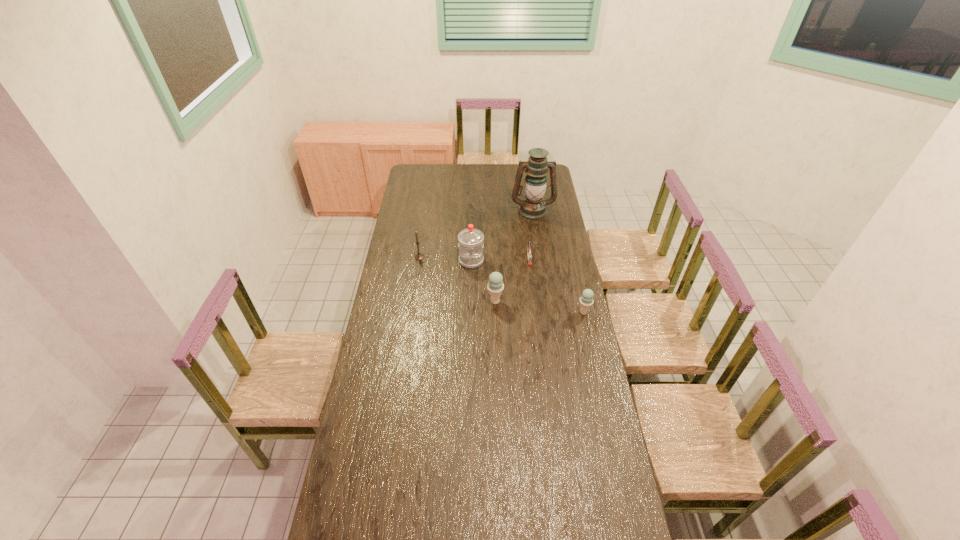
I want to click on free space located on the back of the fifth farthest object, so click(x=494, y=276).

Find the location of a particular element. This screenshot has width=960, height=540. free space located 0.060m on the back of the rightmost object is located at coordinates (581, 298).

Where is `free location located on the back of the leftmost object`? The height and width of the screenshot is (540, 960). free location located on the back of the leftmost object is located at coordinates (425, 217).

I want to click on vacant region located on the back of the oil lamp, so click(528, 180).

What are the coordinates of `vacant space situated on the handle side of the shortest object` in the screenshot? It's located at (535, 309).

Locate an element on the screen. The width and height of the screenshot is (960, 540). free space located 0.360m on the handle side of the fifth shortest object is located at coordinates (470, 325).

At what (x,y) coordinates should I click in order to perform the action: click on object at the left edge. Please return your answer as a coordinate pair (x, y). The width and height of the screenshot is (960, 540). Looking at the image, I should click on (419, 256).

Locate an element on the screen. The height and width of the screenshot is (540, 960). ice cream that is at the right edge is located at coordinates [x=586, y=300].

Where is `oil lamp located in the right edge section of the desktop`? The image size is (960, 540). oil lamp located in the right edge section of the desktop is located at coordinates (533, 207).

What are the coordinates of `free space at the far edge of the desktop` in the screenshot? It's located at tap(497, 177).